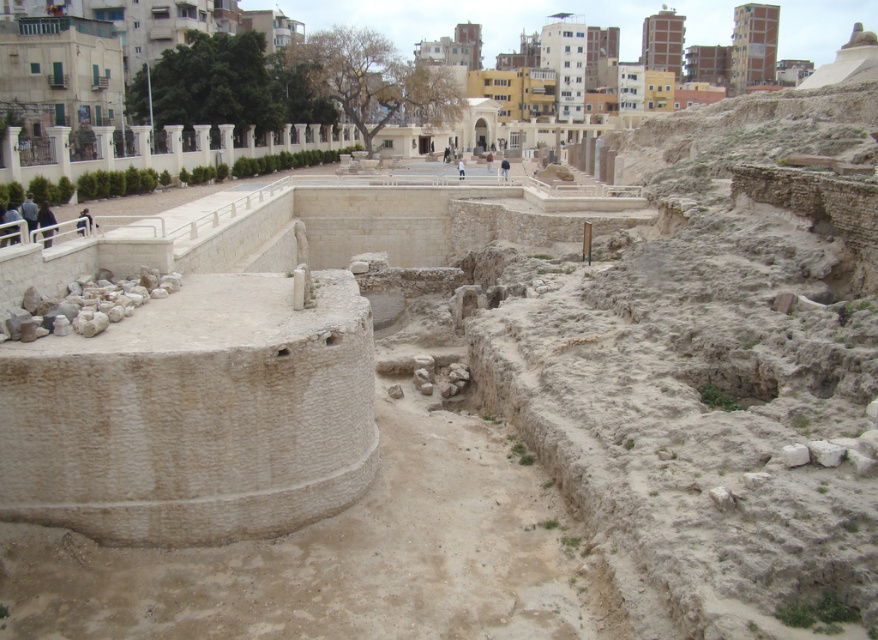
You are a visitor at the archaeological site and notice two jackets left unattended. The dark blue fabric jacket at upper left and the light brown leather jacket at center. Which jacket is closer to the ground?

The dark blue fabric jacket at upper left is positioned under the light brown leather jacket at center, so it is closer to the ground.

You are a tour guide at the archaeological site and notice two visitors wearing the dark blue fabric jacket at upper left and the light blue fabric at center. From your vantage point, which visitor is closer to you?

The dark blue fabric jacket at upper left is in front of the light blue fabric at center, so the visitor wearing the dark blue fabric jacket at upper left is closer to you.